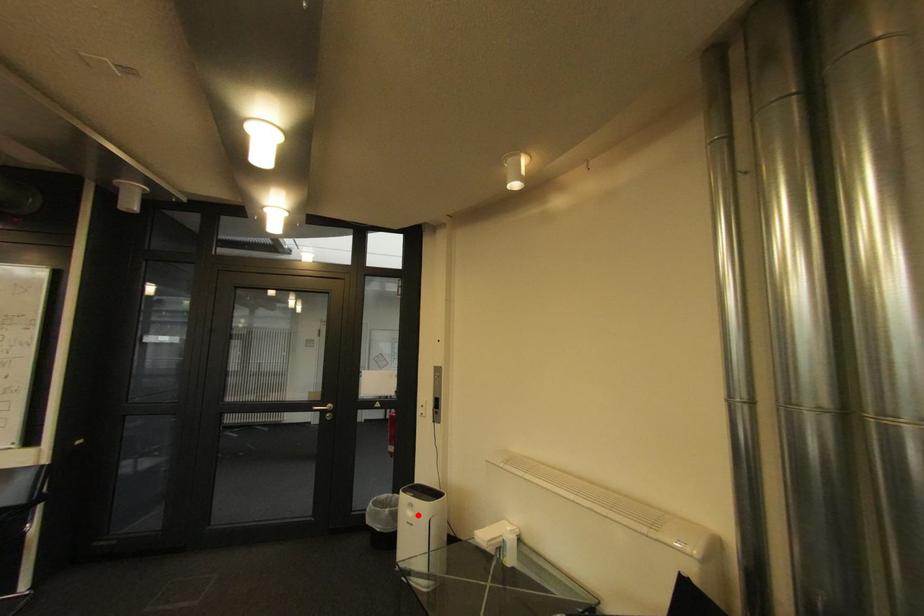
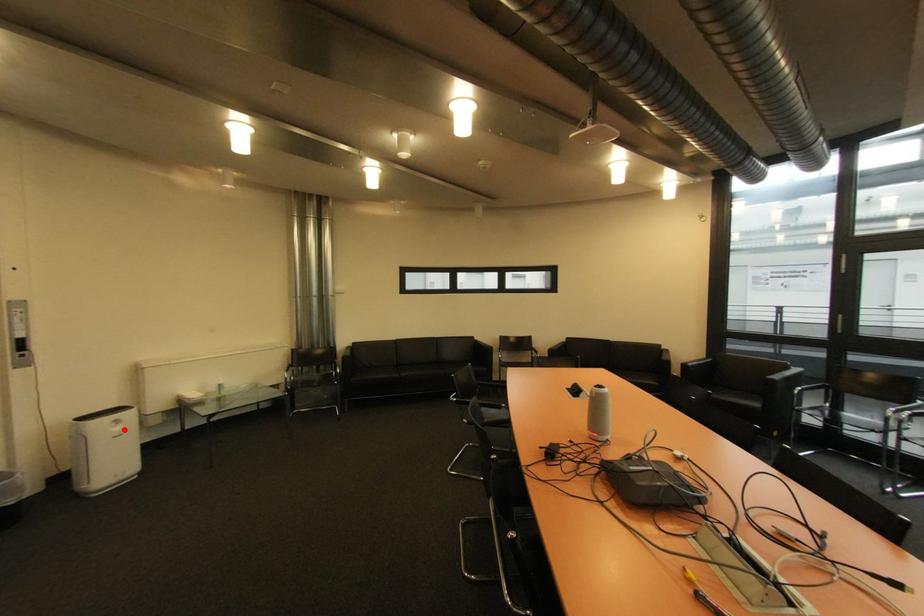
I am providing you with two images of the same scene from different viewpoints. A red point is marked on the first image and another point is marked on the second image. Does the point marked in image1 correspond to the same location as the one in image2?

Yes